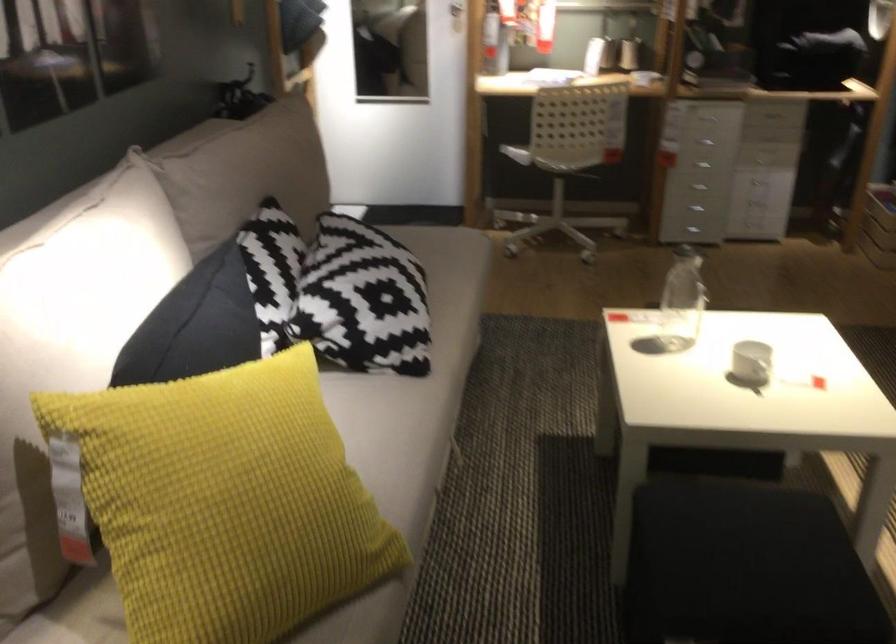
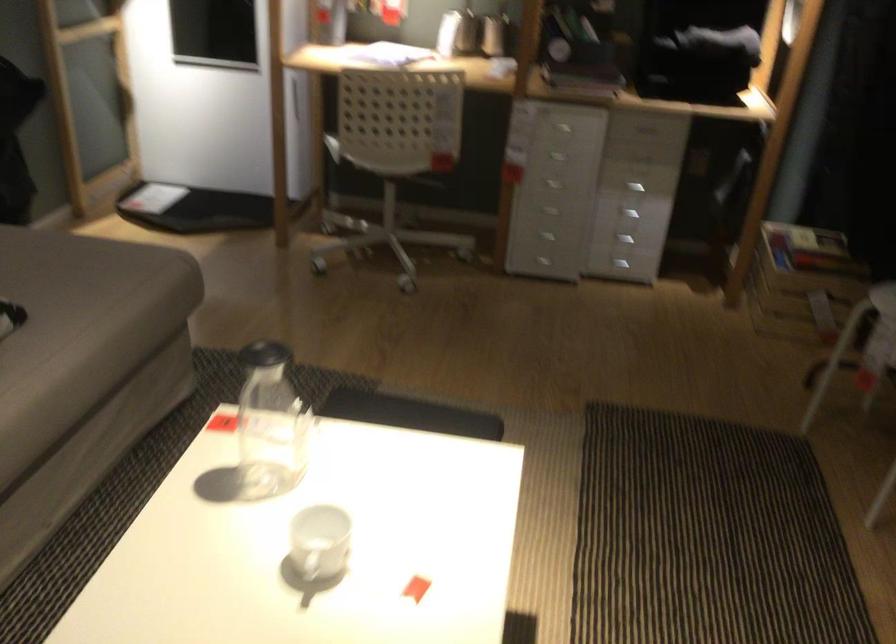
Find the pixel in the second image that matches point (455, 285) in the first image.

(82, 324)